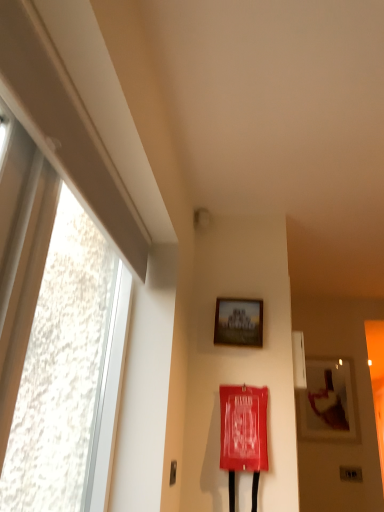
Question: Which direction should I rotate to look at matte wooden picture frame at upper center, the first picture frame when ordered from left to right?

Choices:
 (A) left
 (B) right

Answer: (B)

Question: Is transparent glass window at left located outside metallic silver door handle at lower left?

Choices:
 (A) yes
 (B) no

Answer: (A)

Question: From the image's perspective, does transparent glass window at left appear higher than metallic silver door handle at lower left?

Choices:
 (A) no
 (B) yes

Answer: (B)

Question: Does transparent glass window at left lie behind metallic silver door handle at lower left?

Choices:
 (A) no
 (B) yes

Answer: (A)

Question: Could you tell me if transparent glass window at left is facing metallic silver door handle at lower left?

Choices:
 (A) no
 (B) yes

Answer: (A)

Question: From the image's perspective, is transparent glass window at left beneath metallic silver door handle at lower left?

Choices:
 (A) no
 (B) yes

Answer: (A)

Question: Is transparent glass window at left oriented away from metallic silver door handle at lower left?

Choices:
 (A) yes
 (B) no

Answer: (B)

Question: From a real-world perspective, is wooden picture frame at upper right, acting as the first picture frame starting from the back, located beneath transparent glass window at left?

Choices:
 (A) no
 (B) yes

Answer: (A)

Question: Is the surface of wooden picture frame at upper right, which is counted as the 2th picture frame, starting from the left, in direct contact with transparent glass window at left?

Choices:
 (A) no
 (B) yes

Answer: (A)

Question: Can you confirm if wooden picture frame at upper right, acting as the first picture frame starting from the back, is thinner than transparent glass window at left?

Choices:
 (A) no
 (B) yes

Answer: (B)

Question: Considering the relative positions of wooden picture frame at upper right, which is the 2th picture frame from front to back, and transparent glass window at left in the image provided, is wooden picture frame at upper right, which is the 2th picture frame from front to back, to the right of transparent glass window at left from the viewer's perspective?

Choices:
 (A) yes
 (B) no

Answer: (A)

Question: Considering the relative positions of wooden picture frame at upper right, acting as the first picture frame starting from the back, and transparent glass window at left in the image provided, is wooden picture frame at upper right, acting as the first picture frame starting from the back, to the left of transparent glass window at left from the viewer's perspective?

Choices:
 (A) no
 (B) yes

Answer: (A)

Question: From a real-world perspective, does wooden picture frame at upper right, which appears as the second picture frame when viewed from the top, stand above transparent glass window at left?

Choices:
 (A) yes
 (B) no

Answer: (A)

Question: Considering the relative sizes of metallic silver door handle at lower left and wooden picture frame at upper right, which is the 2th picture frame from front to back, in the image provided, is metallic silver door handle at lower left shorter than wooden picture frame at upper right, which is the 2th picture frame from front to back,?

Choices:
 (A) no
 (B) yes

Answer: (B)